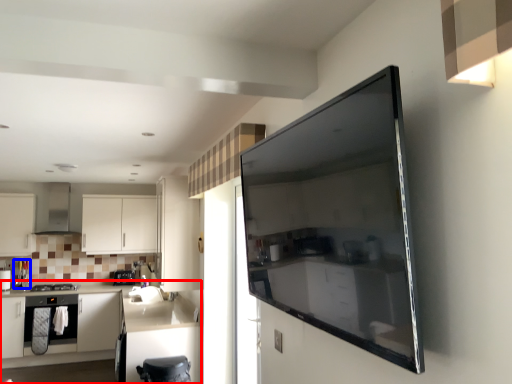
Question: Among these objects, which one is farthest to the camera, cabinetry (highlighted by a red box) or appliance (highlighted by a blue box)?

Choices:
 (A) cabinetry
 (B) appliance

Answer: (B)